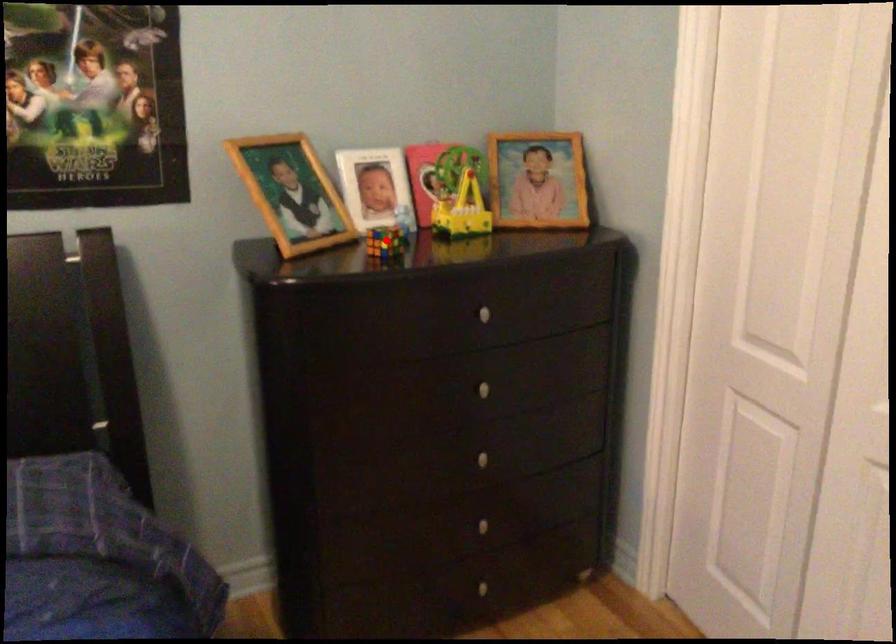
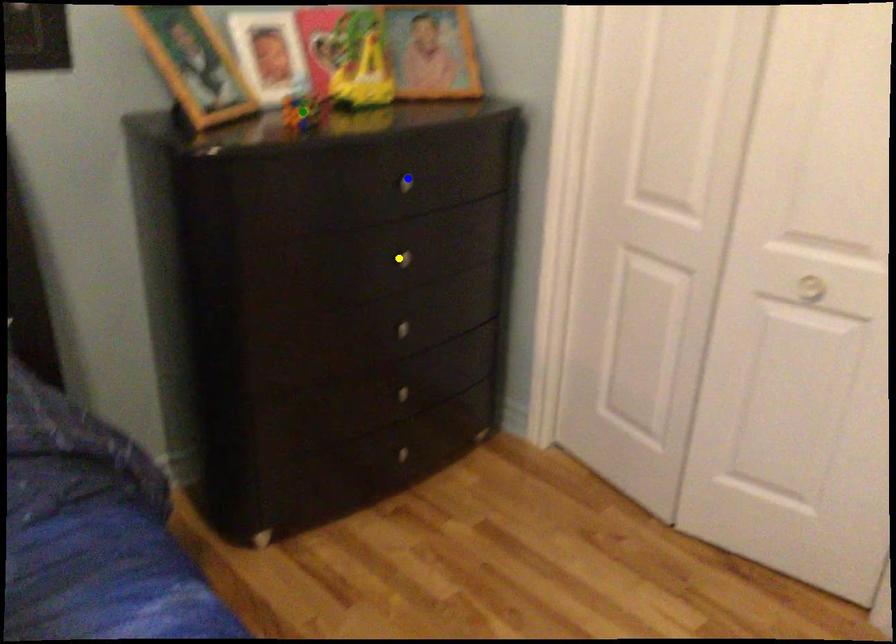
Question: I am providing you with two images of the same scene from different viewpoints. A red point is marked on the first image. You are given multiple points on the second image. Which mark in image 2 goes with the point in image 1?

Choices:
 (A) green point
 (B) blue point
 (C) yellow point

Answer: (A)